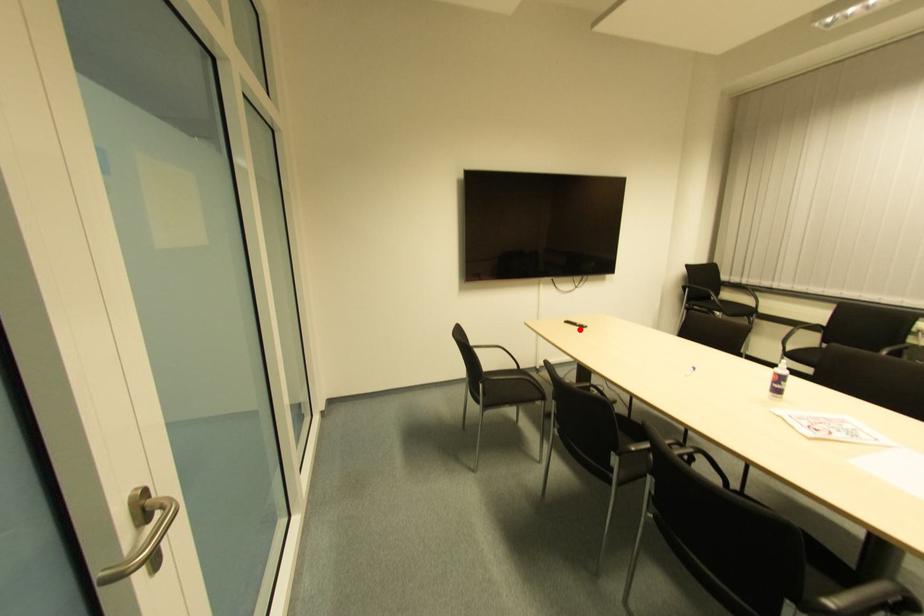
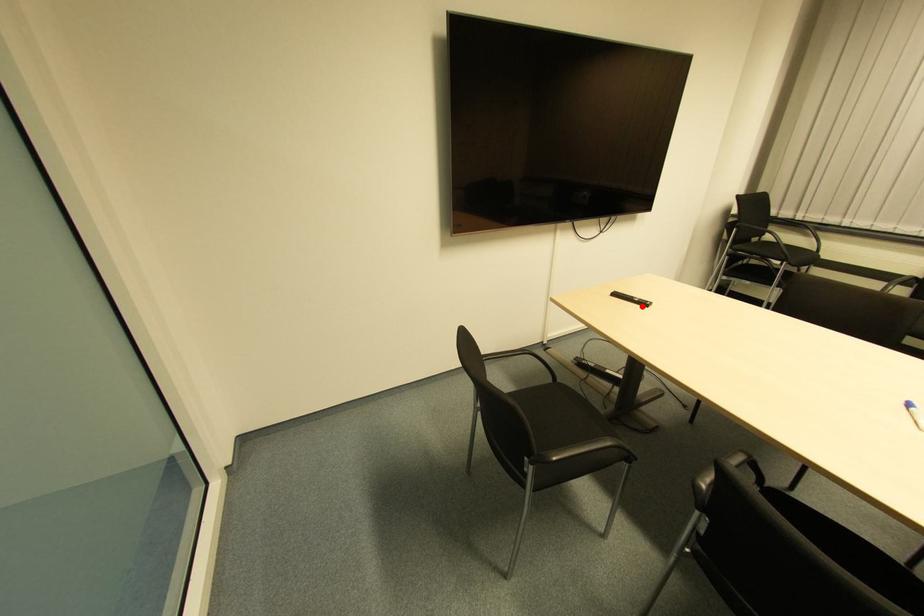
I am providing you with two images of the same scene from different viewpoints. A red point is marked on the first image and another point is marked on the second image. Do the highlighted points in image1 and image2 indicate the same real-world spot?

Yes